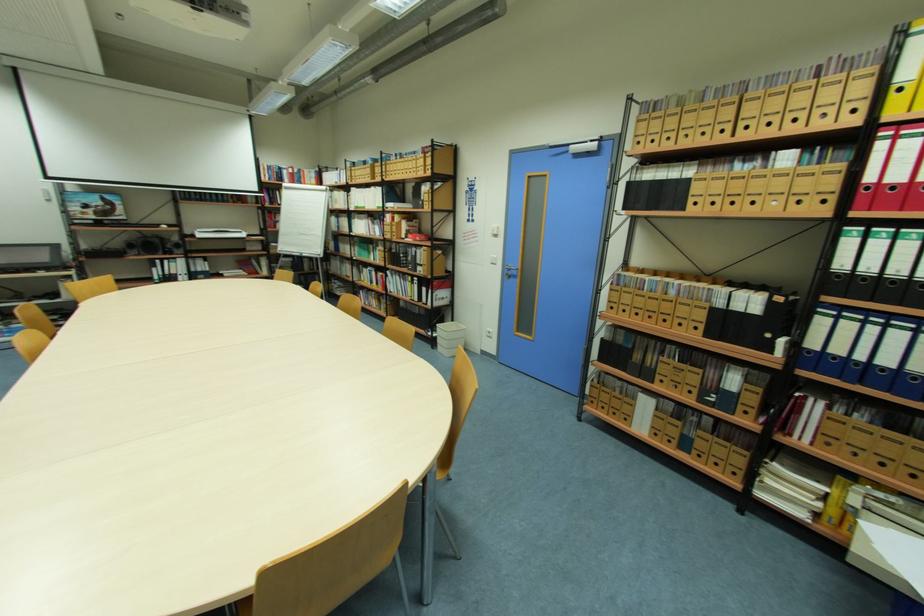
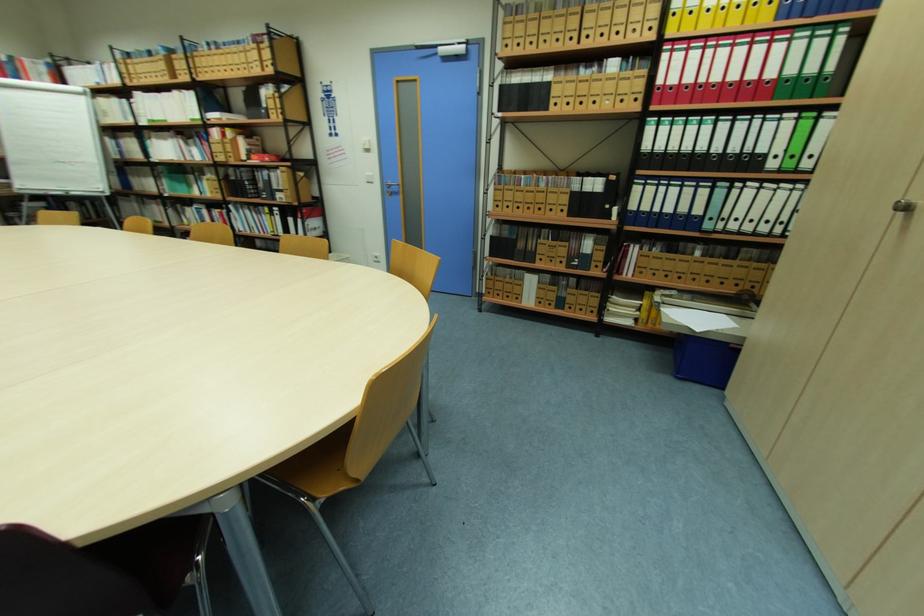
Question: The images are taken continuously from a first-person perspective. In which direction are you moving?

Choices:
 (A) Left
 (B) Right
 (C) Forward
 (D) Backward

Answer: (A)